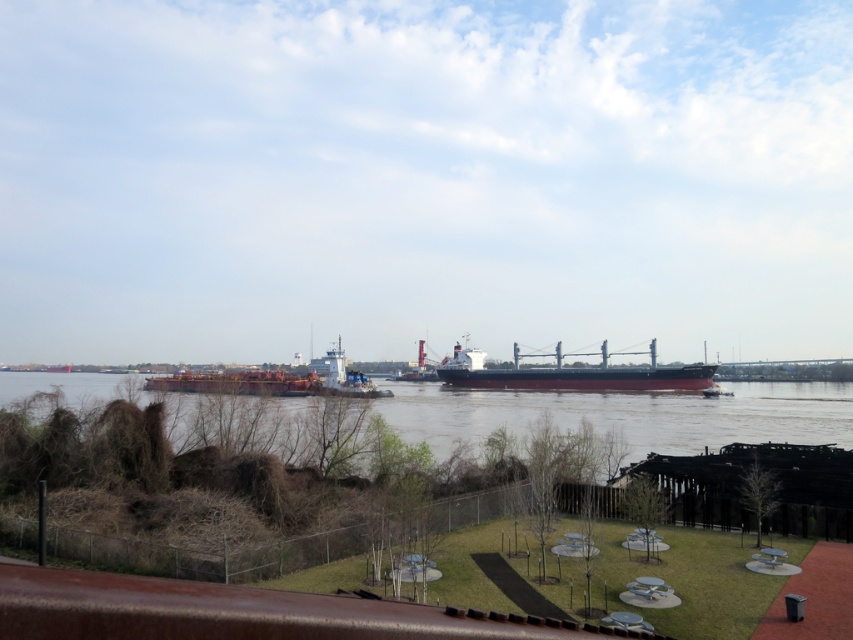
You are a photographer standing at the edge of the grassy area enclosed by the chain link fence. You want to take a photo of the brown matte river at center and the rustic metal barge at center. Which object should you position to the left in your camera frame to capture both in the same shot?

To capture both the brown matte river at center and the rustic metal barge at center in the same shot, you should position the rustic metal barge at center to the left in your camera frame since the brown matte river at center is on the right side of the rustic metal barge at center.

You are standing at the grassy area enclosed by the chainlink fence and want to reach the brown matte river at center. According to the coordinates provided, in which direction should you walk to get there?

The brown matte river at center is located at coordinates point (630,413). Since the coordinate system typically has the origin at the bottom left corner, moving towards higher x values means going to the right and higher y values mean going upwards. Therefore, you should walk towards the upper right direction to reach the brown matte river at center.

You are standing at the edge of the grassy area enclosed by the chainlink fence in the riverside scene. You want to throw a pebble into the brown matte river at center. If your throwing distance is 40 meters, will you be able to reach the river?

The brown matte river at center is 46.07 meters away from the viewer. Since your throwing distance is only 40 meters, you cannot reach the river with a single throw.